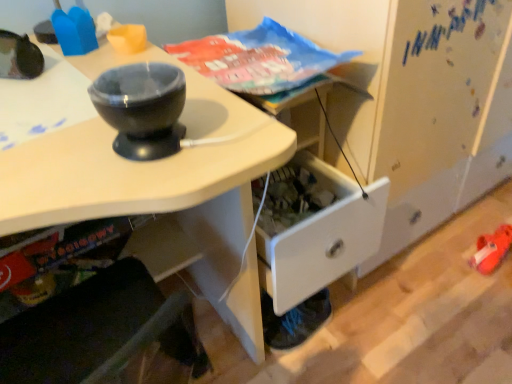
Identify the location of free spot in front of blue fabric shoe at lower right. pyautogui.click(x=308, y=364).